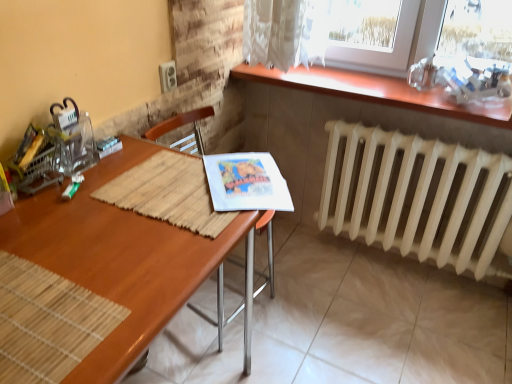
At what (x,y) coordinates should I click in order to perform the action: click on unoccupied region to the right of wooden chair at center. Please return your answer as a coordinate pair (x, y). Looking at the image, I should click on (307, 310).